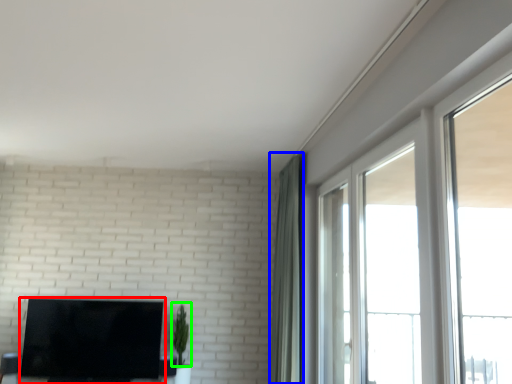
Question: Which is farther away from television (highlighted by a red box)? curtain (highlighted by a blue box) or plant (highlighted by a green box)?

Choices:
 (A) curtain
 (B) plant

Answer: (A)